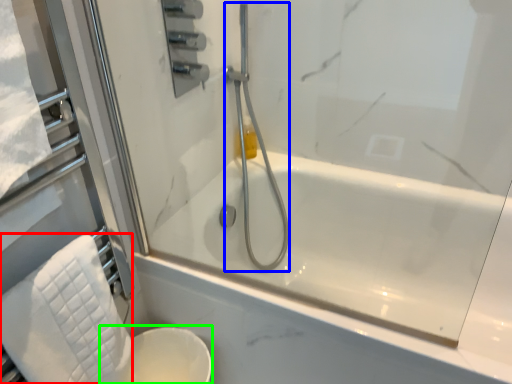
Question: Considering the real-world distances, which object is farthest from bath towel (highlighted by a red box)? shower (highlighted by a blue box) or toilet bowl (highlighted by a green box)?

Choices:
 (A) shower
 (B) toilet bowl

Answer: (A)